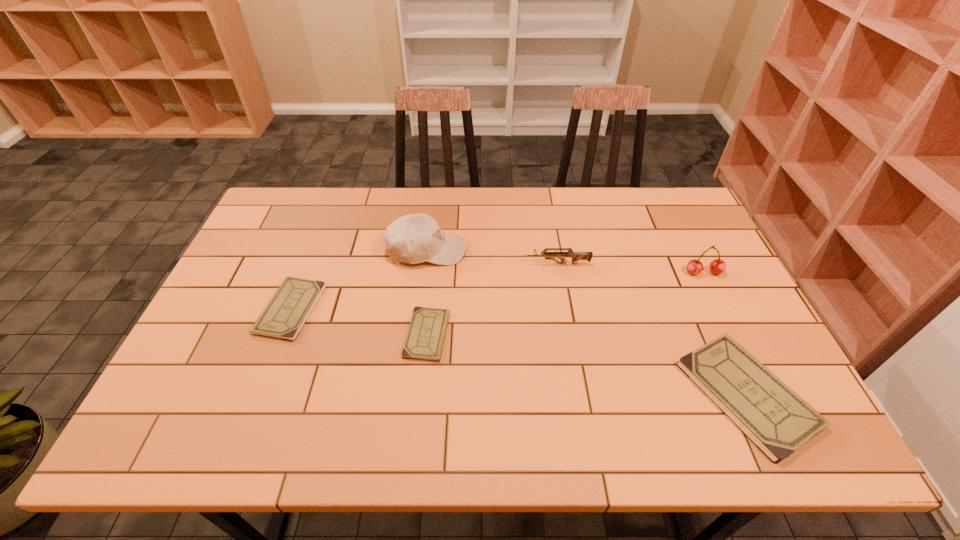
This screenshot has width=960, height=540. Find the location of `free space that satisfies the following two spatial constraints: 1. aimed along the barrel of the gun; 2. on the back side of the third shortest object`. free space that satisfies the following two spatial constraints: 1. aimed along the barrel of the gun; 2. on the back side of the third shortest object is located at coordinates (580, 394).

What are the coordinates of `vacant region that satisfies the following two spatial constraints: 1. on the front-facing side of the baseball cap; 2. on the back side of the second checkbook from left to right` in the screenshot? It's located at (417, 334).

This screenshot has height=540, width=960. In order to click on vacant point that satisfies the following two spatial constraints: 1. on the front-facing side of the baseball cap; 2. on the back side of the shortest checkbook in this screenshot , I will do `click(417, 334)`.

The height and width of the screenshot is (540, 960). What are the coordinates of `free spot that satisfies the following two spatial constraints: 1. on the back side of the tallest checkbook; 2. on the front-facing side of the baseball cap` in the screenshot? It's located at (680, 250).